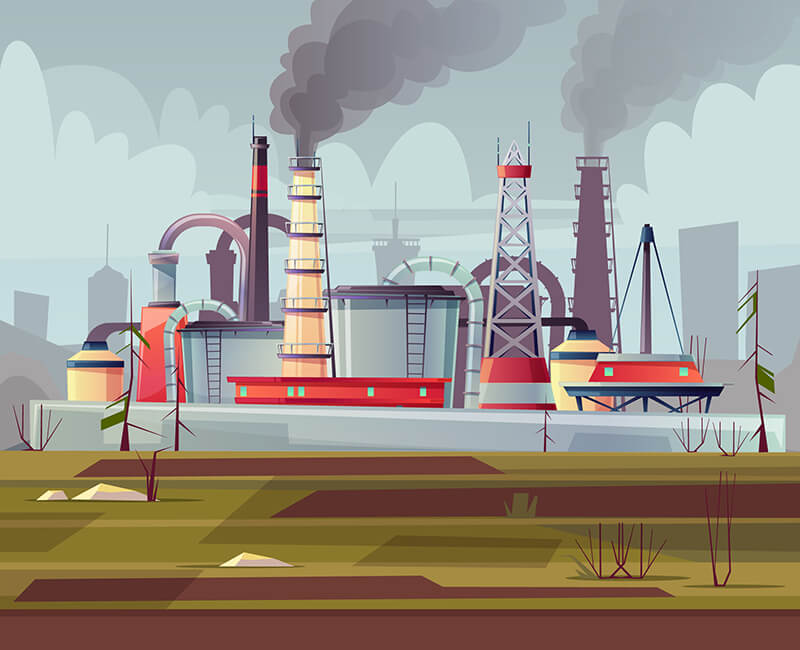
At what (x,y) coordinates should I click in order to perform the action: click on ladders. Please return your answer as a coordinate pair (x, y). This screenshot has height=650, width=800. Looking at the image, I should click on (421, 330), (209, 359).